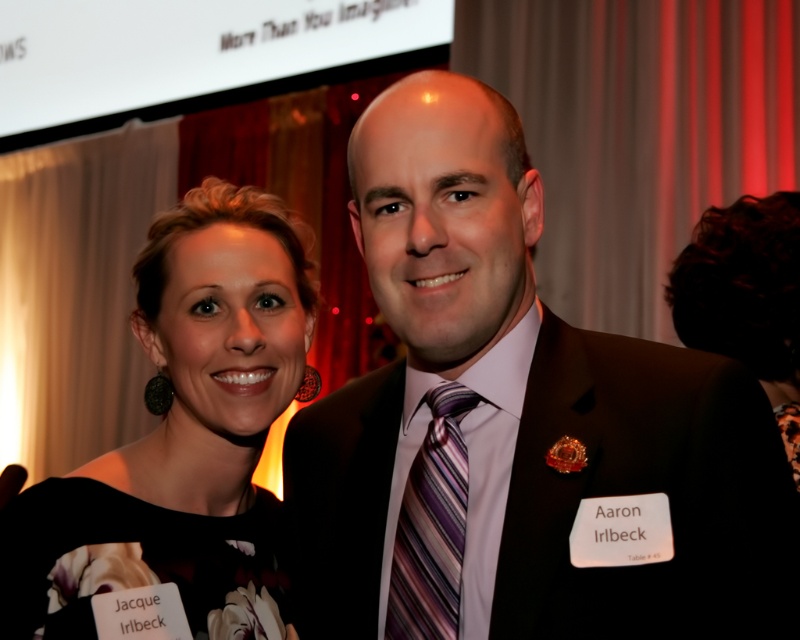
Question: Which point is closer to the camera?

Choices:
 (A) black floral dress at center
 (B) striped silk tie at center
 (C) matte black suit at center

Answer: (C)

Question: Is matte black suit at center to the right of black floral dress at center from the viewer's perspective?

Choices:
 (A) no
 (B) yes

Answer: (B)

Question: Observing the image, what is the correct spatial positioning of matte black suit at center in reference to striped silk tie at center?

Choices:
 (A) above
 (B) below

Answer: (A)

Question: Can you confirm if black floral dress at center is bigger than striped silk tie at center?

Choices:
 (A) no
 (B) yes

Answer: (B)

Question: Which point is farther to the camera?

Choices:
 (A) striped silk tie at center
 (B) matte black suit at center

Answer: (A)

Question: Which object is positioned closest to the striped silk tie at center?

Choices:
 (A) black floral dress at center
 (B) matte black suit at center

Answer: (B)